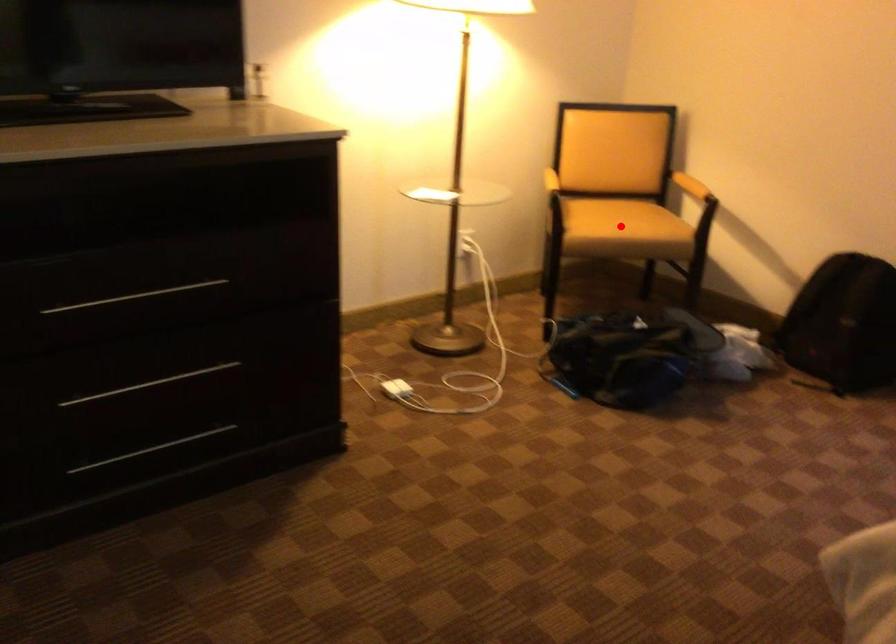
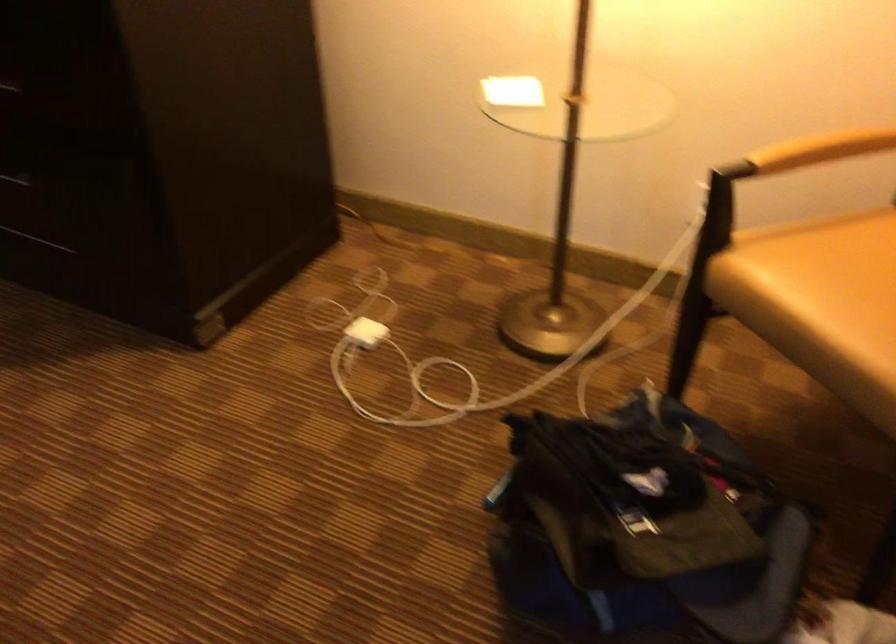
Question: I am providing you with two images of the same scene from different viewpoints. In image1, a red point is highlighted. Considering the same 3D point in image2, which of the following is correct?

Choices:
 (A) It is closer
 (B) It is farther

Answer: (A)